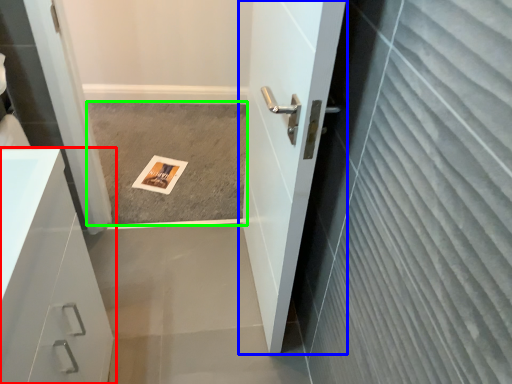
Question: Based on their relative distances, which object is nearer to bathroom cabinet (highlighted by a red box)? Choose from door (highlighted by a blue box) and concrete (highlighted by a green box).

Choices:
 (A) door
 (B) concrete

Answer: (A)